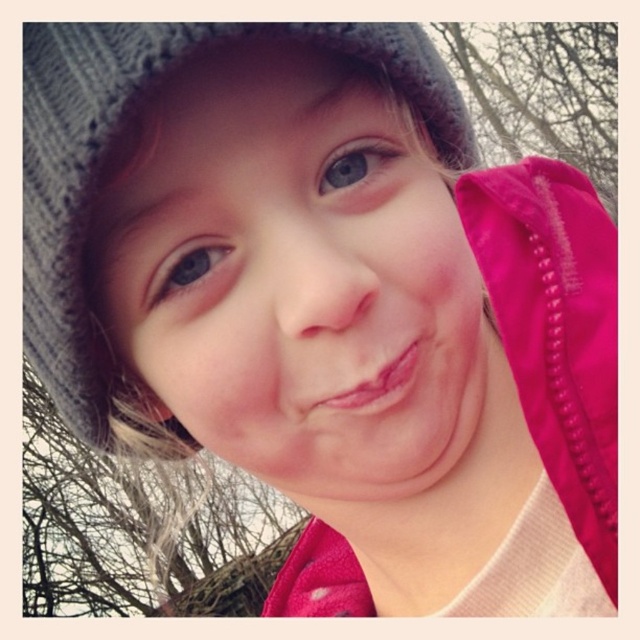
Based on the scene description, which object is positioned higher up on the child, the matte gray knit hat at center or the blue matte eye at upper center?

The blue matte eye at upper center is positioned higher up on the child than the matte gray knit hat at center.

You are an artist sketching this child and want to draw the eyes accurately. Which blue matte eye is closer to you, the blue matte eye at upper center or the blue matte eye at upper left?

The blue matte eye at upper center is closer to you because the blue matte eye at upper left is behind it.

The child in the image is wearing a matte gray knit hat at center and has a blue matte eye at upper left visible. Which object has a greater width?

The matte gray knit hat at center has a greater width than the blue matte eye at upper left.